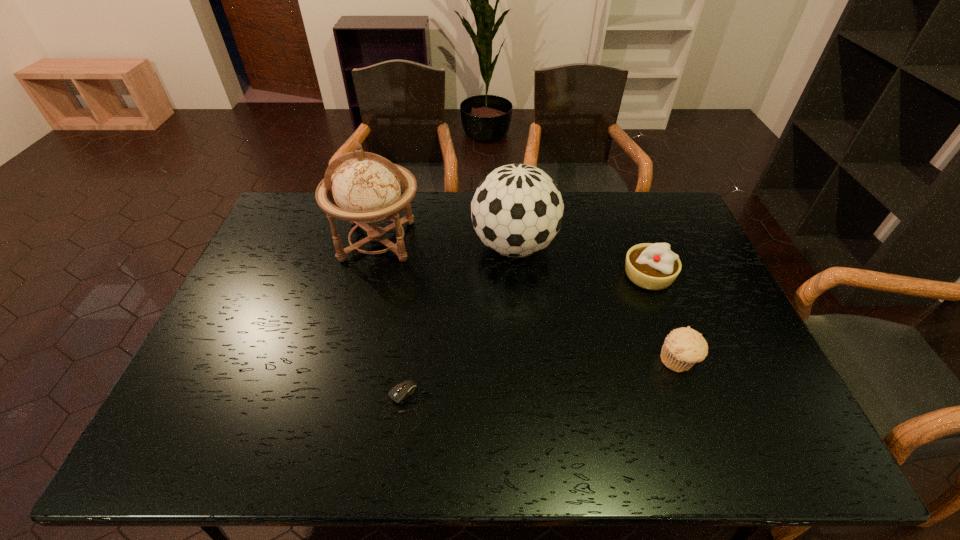
The width and height of the screenshot is (960, 540). I want to click on blank area located 0.330m on the front of the third shortest object, so click(x=693, y=395).

Locate an element on the screen. vacant space located on the back of the fourth tallest object is located at coordinates (666, 330).

The width and height of the screenshot is (960, 540). In order to click on vacant space located 0.130m on the back of the shortest object in this screenshot , I will do `click(412, 339)`.

Find the location of `globe situated at the far edge`. globe situated at the far edge is located at coordinates (366, 188).

Locate an element on the screen. This screenshot has width=960, height=540. soccer ball present at the far edge is located at coordinates (517, 210).

Where is `object situated at the near edge`? The height and width of the screenshot is (540, 960). object situated at the near edge is located at coordinates (401, 391).

Find the location of a particular element. This screenshot has width=960, height=540. whipped cream present at the right edge is located at coordinates (650, 266).

The height and width of the screenshot is (540, 960). I want to click on muffin situated at the right edge, so click(683, 347).

I want to click on free space at the far edge of the desktop, so click(428, 218).

In the image, there is a desktop. Where is `free space at the near edge`? The image size is (960, 540). free space at the near edge is located at coordinates pyautogui.click(x=263, y=428).